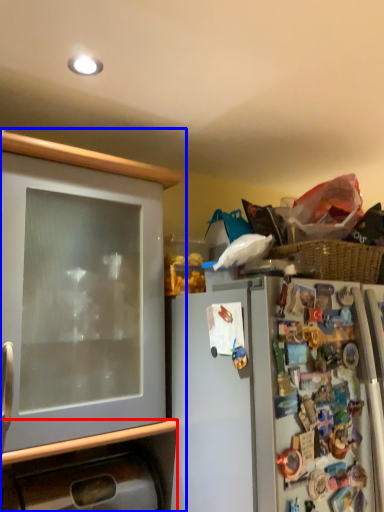
Question: Which of the following is the farthest to the observer, cabinetry (highlighted by a red box) or cabinetry (highlighted by a blue box)?

Choices:
 (A) cabinetry
 (B) cabinetry

Answer: (A)